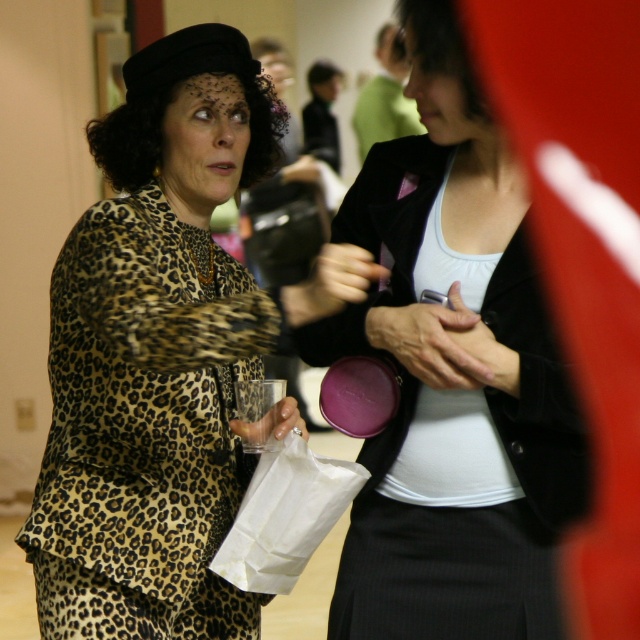
Does matte black blazer at center appear over leopard print dress at center?

Indeed, matte black blazer at center is positioned over leopard print dress at center.

Is point (401, 289) behind point (186, 573)?

No, (401, 289) is in front of (186, 573).

At what (x,y) coordinates should I click in order to perform the action: click on matte black blazer at center. Please return your answer as a coordinate pair (x, y). The height and width of the screenshot is (640, 640). Looking at the image, I should click on (452, 378).

Who is shorter, leopard print dress at center or white paper bag at lower center?

With less height is white paper bag at lower center.

Who is more distant from viewer, [192,280] or [260,497]?

The point [192,280] is more distant.

The height and width of the screenshot is (640, 640). What are the coordinates of `leopard print dress at center` in the screenshot? It's located at (145, 428).

Find the location of `leopard print dress at center`. leopard print dress at center is located at coordinates (145, 428).

Does matte black blazer at center have a greater width compared to white paper bag at lower center?

Correct, the width of matte black blazer at center exceeds that of white paper bag at lower center.

Is point (432, 58) less distant than point (307, 548)?

Yes, it is.

Identify the location of matte black blazer at center. (452, 378).